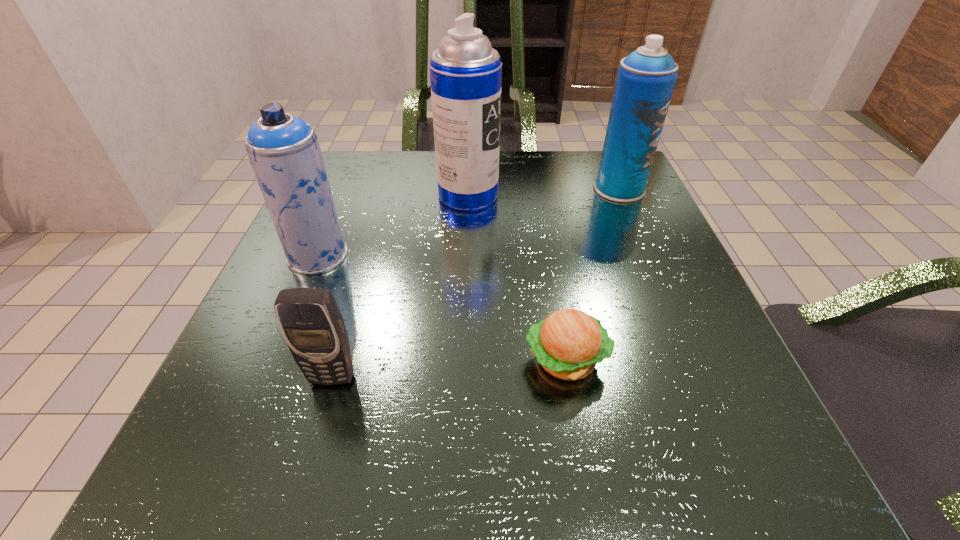
This screenshot has height=540, width=960. I want to click on free spot located on the right of the leftmost object, so click(x=445, y=255).

Find the location of `free spot located 0.140m on the front face of the second shortest object`. free spot located 0.140m on the front face of the second shortest object is located at coordinates (300, 494).

You are a GUI agent. You are given a task and a screenshot of the screen. Output one action in this format:
    pyautogui.click(x=<x>, y=<y>)
    Task: Click on the free location located on the back of the second object from right to left
    This screenshot has width=960, height=540.
    Given the screenshot: What is the action you would take?
    pyautogui.click(x=541, y=220)

Find the location of a particular element. aerosol can located at the left edge is located at coordinates (284, 151).

Identify the location of cellular telephone that is at the left edge. (311, 323).

Find the location of `object present at the right edge`. object present at the right edge is located at coordinates (646, 78).

The image size is (960, 540). In order to click on object located at the far right corner in this screenshot , I will do `click(646, 78)`.

The height and width of the screenshot is (540, 960). In the image, there is a desktop. In order to click on vacant space at the far edge in this screenshot , I will do `click(399, 206)`.

This screenshot has width=960, height=540. Identify the location of vacant space at the left edge of the desktop. (378, 210).

Find the location of a particular element. The height and width of the screenshot is (540, 960). free spot at the right edge of the desktop is located at coordinates (665, 368).